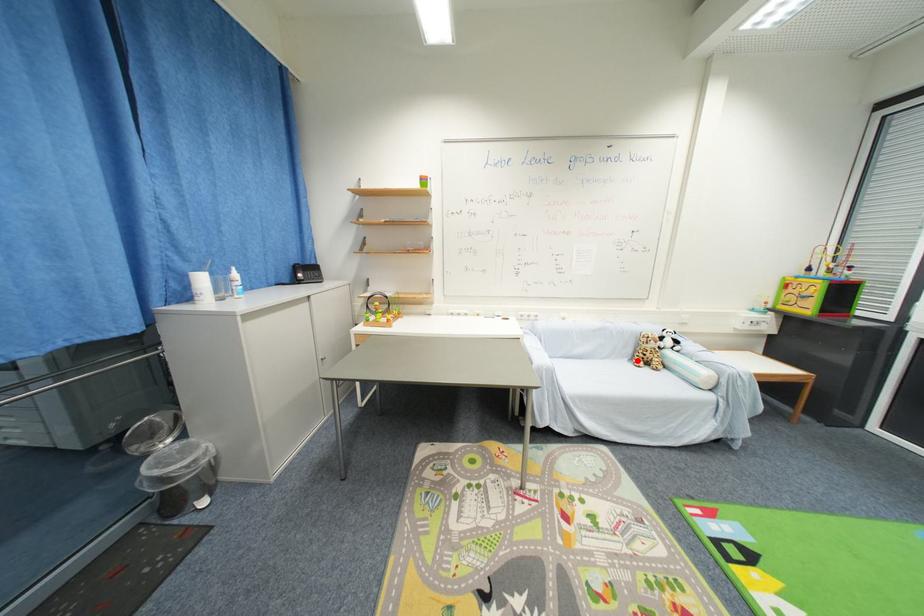
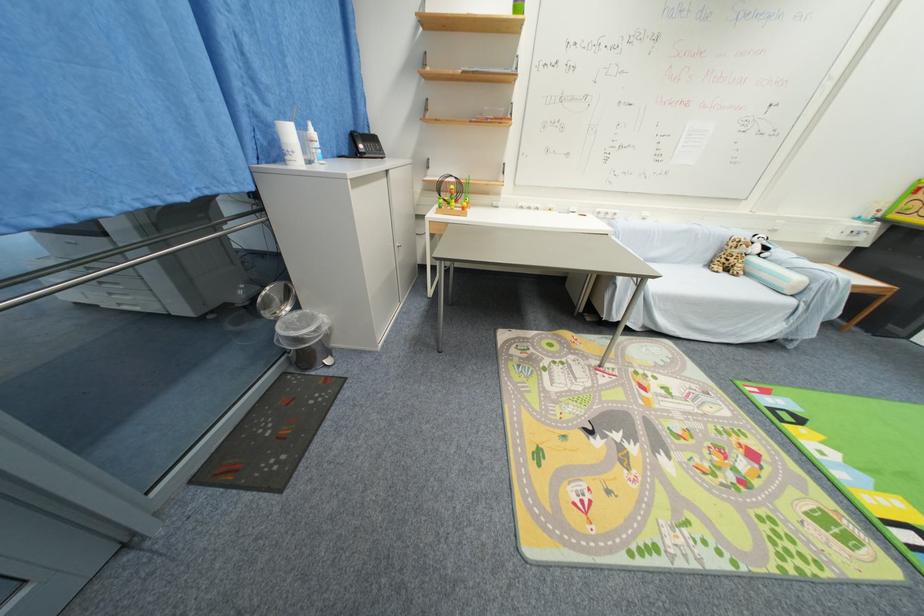
In the second image, find the point that corresponds to the highlighted location in the first image.

(714, 265)